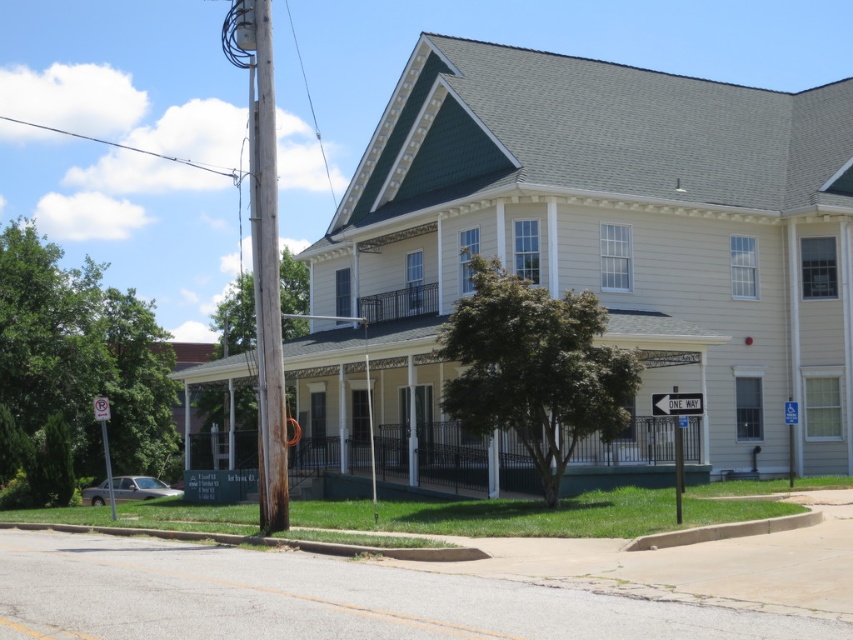
You are standing at point (624, 458) on the image. What is the material of the structure you are currently standing on?

The structure at point (624, 458) is green painted wood porch at center.

You are standing in front of the two story building and want to walk towards the two points marked in the image. Which point would you reach first, point (x=606, y=468) or point (x=271, y=124)?

You would reach point (x=271, y=124) first because it is closer to you than point (x=606, y=468), which is further away.